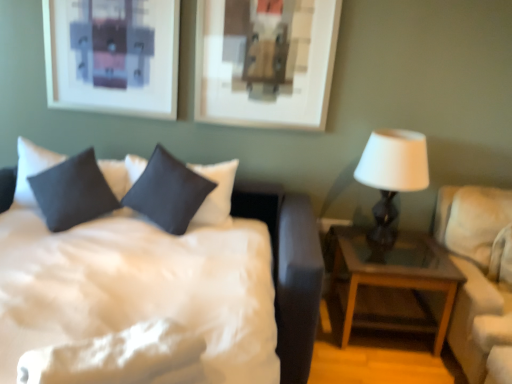
I want to click on wooden nightstand at right, so click(389, 277).

This screenshot has height=384, width=512. I want to click on beige fabric couch at right, so click(x=478, y=273).

Is dark gray fabric pillow at upper left, which ranks as the second pillow in right-to-left order, beside wooden nightstand at right?

dark gray fabric pillow at upper left, which ranks as the second pillow in right-to-left order, and wooden nightstand at right are not in contact.

Is dark gray fabric pillow at upper left, marked as the first pillow in a left-to-right arrangement, smaller than wooden nightstand at right?

Yes.

Is white satin bed at center directly adjacent to wooden nightstand at right?

No, white satin bed at center is not in contact with wooden nightstand at right.

Measure the distance from white satin bed at center to wooden nightstand at right.

A distance of 36.38 inches exists between white satin bed at center and wooden nightstand at right.

Between white satin bed at center and wooden nightstand at right, which one appears on the left side from the viewer's perspective?

white satin bed at center is more to the left.

Which is in front, point (151, 318) or point (405, 251)?

The point (151, 318) is closer.

Is white satin bed at center placed right next to white matte table lamp at right?

No, white satin bed at center is not next to white matte table lamp at right.

Is white satin bed at center in front of white matte table lamp at right?

Yes, white satin bed at center is in front of white matte table lamp at right.

Can you tell me how much white satin bed at center and white matte table lamp at right differ in facing direction?

1 degrees separate the facing orientations of white satin bed at center and white matte table lamp at right.

Is white satin bed at center oriented towards white matte table lamp at right?

No, white satin bed at center does not turn towards white matte table lamp at right.

What's the angular difference between white matte table lamp at right and dark gray fabric pillow at upper left, marked as the first pillow in a left-to-right arrangement,'s facing directions?

There is a 4.75-degree angle between the facing directions of white matte table lamp at right and dark gray fabric pillow at upper left, marked as the first pillow in a left-to-right arrangement.

Is white matte table lamp at right behind dark gray fabric pillow at upper left, marked as the first pillow in a left-to-right arrangement?

Yes, it is.

Looking at this image, is white matte table lamp at right inside the boundaries of dark gray fabric pillow at upper left, marked as the first pillow in a left-to-right arrangement, or outside?

white matte table lamp at right cannot be found inside dark gray fabric pillow at upper left, marked as the first pillow in a left-to-right arrangement.

Is white matte table lamp at right next to dark gray fabric pillow at upper left, which ranks as the second pillow in right-to-left order?

No, white matte table lamp at right is not making contact with dark gray fabric pillow at upper left, which ranks as the second pillow in right-to-left order.

Looking at this image, is dark gray fabric pillow at upper left, which ranks as the second pillow in right-to-left order, turned away from white matte table lamp at right?

No, dark gray fabric pillow at upper left, which ranks as the second pillow in right-to-left order, is not facing the opposite direction of white matte table lamp at right.

Between dark gray fabric pillow at upper left, which ranks as the second pillow in right-to-left order, and white matte table lamp at right, which one has larger size?

With larger size is dark gray fabric pillow at upper left, which ranks as the second pillow in right-to-left order.

This screenshot has height=384, width=512. Find the location of `table lamp below the dark gray fabric pillow at upper left, marked as the first pillow in a left-to-right arrangement (from the image's perspective)`. table lamp below the dark gray fabric pillow at upper left, marked as the first pillow in a left-to-right arrangement (from the image's perspective) is located at coordinates point(392,175).

From the image's perspective, which object appears higher, dark gray fabric pillow at upper left, marked as the first pillow in a left-to-right arrangement, or white matte table lamp at right?

From the image's view, dark gray fabric pillow at upper left, marked as the first pillow in a left-to-right arrangement, is above.

From the picture: Is white matte table lamp at right beside beige fabric couch at right?

No, white matte table lamp at right is not touching beige fabric couch at right.

Is white matte table lamp at right in front of or behind beige fabric couch at right in the image?

In the image, white matte table lamp at right appears behind beige fabric couch at right.

From the image's perspective, between white matte table lamp at right and beige fabric couch at right, who is located below?

beige fabric couch at right.

From the picture: Choose the correct answer: Is satin dark blue pillow at center, placed as the 1th pillow when sorted from right to left, inside dark gray fabric pillow at upper left, which ranks as the second pillow in right-to-left order, or outside it?

The correct answer is: outside.

Is the depth of satin dark blue pillow at center, arranged as the 2th pillow when viewed from the left, greater than that of dark gray fabric pillow at upper left, marked as the first pillow in a left-to-right arrangement?

Yes, satin dark blue pillow at center, arranged as the 2th pillow when viewed from the left, is further from the viewer.

Considering the positions of points (173, 202) and (39, 181), is point (173, 202) farther from camera compared to point (39, 181)?

That is False.

Is satin dark blue pillow at center, placed as the 1th pillow when sorted from right to left, taller or shorter than dark gray fabric pillow at upper left, marked as the first pillow in a left-to-right arrangement?

In the image, satin dark blue pillow at center, placed as the 1th pillow when sorted from right to left, appears to be shorter than dark gray fabric pillow at upper left, marked as the first pillow in a left-to-right arrangement.

Locate an element on the screen. pillow that is in front of the wooden nightstand at right is located at coordinates (73, 192).

Find the location of a particular element. The width and height of the screenshot is (512, 384). nightstand located behind the white satin bed at center is located at coordinates (389, 277).

Looking at this image, looking at the image, which one is located further to dark gray fabric pillow at upper left, marked as the first pillow in a left-to-right arrangement, white matte table lamp at right or white satin bed at center?

white matte table lamp at right.

Considering their positions, is beige fabric couch at right positioned further to white satin bed at center than white matte table lamp at right?

beige fabric couch at right is positioned further to the anchor white satin bed at center.

From the image, which object appears to be farther from beige fabric couch at right, wooden nightstand at right or white satin bed at center?

white satin bed at center is positioned further to the anchor beige fabric couch at right.

From the image, which object appears to be farther from wooden nightstand at right, satin dark blue pillow at center, placed as the 1th pillow when sorted from right to left, or white matte table lamp at right?

satin dark blue pillow at center, placed as the 1th pillow when sorted from right to left.

From the image, which object appears to be farther from white matte table lamp at right, beige fabric couch at right or white satin bed at center?

Based on the image, white satin bed at center appears to be further to white matte table lamp at right.

When comparing their distances from beige fabric couch at right, does wooden nightstand at right or dark gray fabric pillow at upper left, marked as the first pillow in a left-to-right arrangement, seem closer?

The object closer to beige fabric couch at right is wooden nightstand at right.

From the image, which object appears to be nearer to white satin bed at center, satin dark blue pillow at center, placed as the 1th pillow when sorted from right to left, or dark gray fabric pillow at upper left, which ranks as the second pillow in right-to-left order?

The object closer to white satin bed at center is satin dark blue pillow at center, placed as the 1th pillow when sorted from right to left.

When comparing their distances from satin dark blue pillow at center, placed as the 1th pillow when sorted from right to left, does white satin bed at center or wooden nightstand at right seem closer?

white satin bed at center lies closer to satin dark blue pillow at center, placed as the 1th pillow when sorted from right to left, than the other object.

The image size is (512, 384). In order to click on table lamp between satin dark blue pillow at center, arranged as the 2th pillow when viewed from the left, and beige fabric couch at right, in the horizontal direction in this screenshot , I will do pos(392,175).

At what (x,y) coordinates should I click in order to perform the action: click on nightstand between satin dark blue pillow at center, arranged as the 2th pillow when viewed from the left, and beige fabric couch at right, in the horizontal direction. Please return your answer as a coordinate pair (x, y). Looking at the image, I should click on (389, 277).

Where is `pillow between dark gray fabric pillow at upper left, which ranks as the second pillow in right-to-left order, and white matte table lamp at right`? The image size is (512, 384). pillow between dark gray fabric pillow at upper left, which ranks as the second pillow in right-to-left order, and white matte table lamp at right is located at coordinates (169, 192).

Find the location of a particular element. The height and width of the screenshot is (384, 512). pillow located between dark gray fabric pillow at upper left, which ranks as the second pillow in right-to-left order, and wooden nightstand at right in the left-right direction is located at coordinates (169, 192).